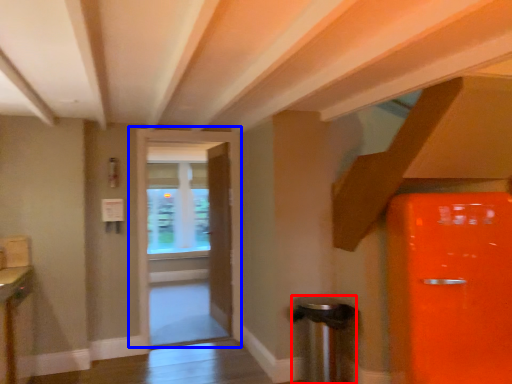
Question: Which object appears closest to the camera in this image, trash bin/can (highlighted by a red box) or door (highlighted by a blue box)?

Choices:
 (A) trash bin/can
 (B) door

Answer: (A)